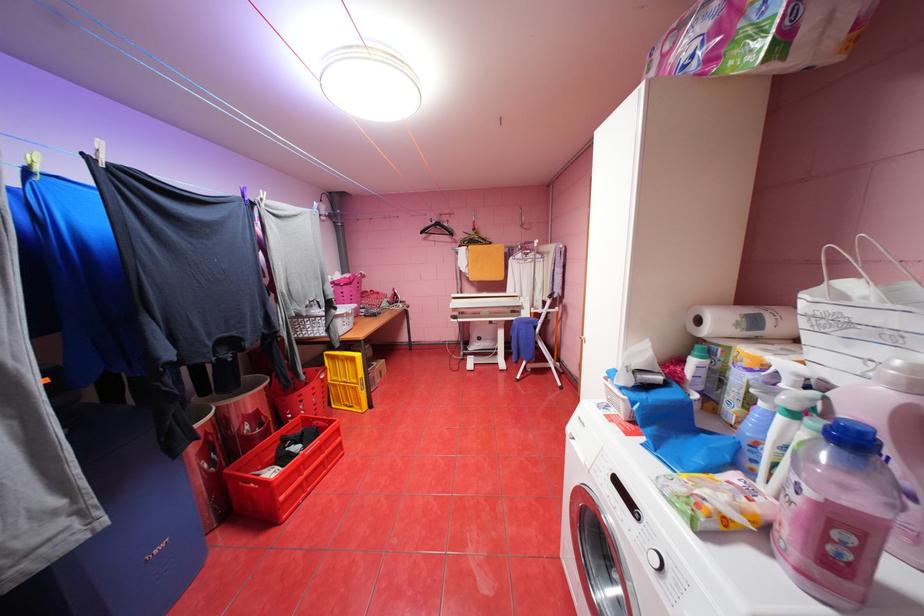
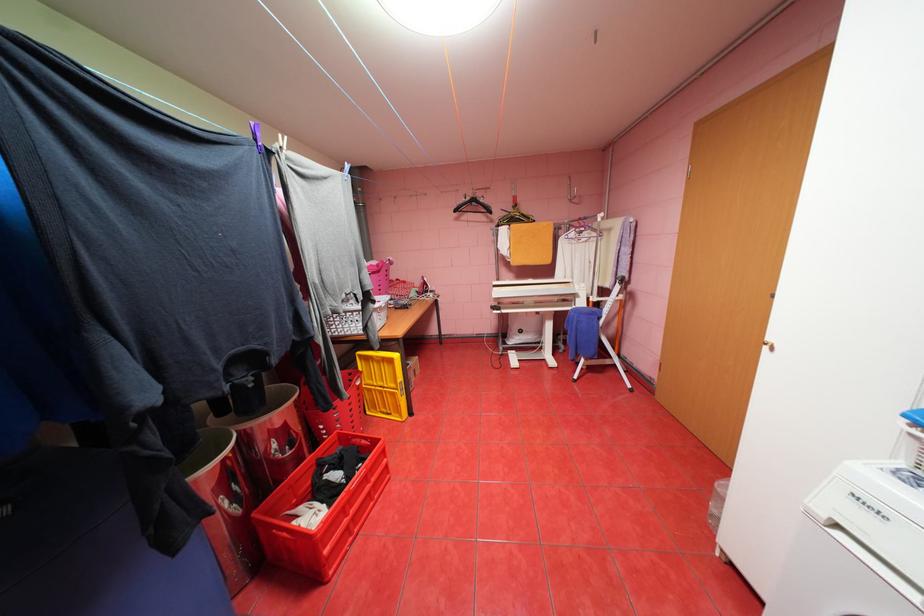
Find the pixel in the second image that matches [465,241] in the first image.

(500, 221)